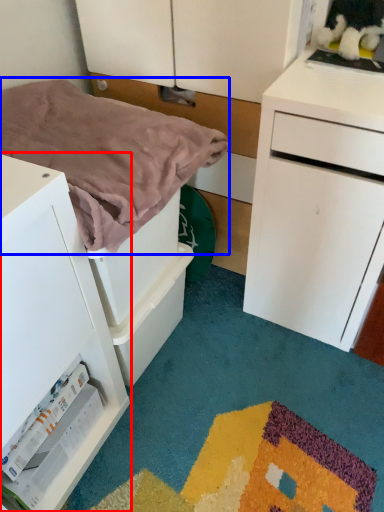
Question: Which point is further to the camera, chest of drawers (highlighted by a red box) or blanket (highlighted by a blue box)?

Choices:
 (A) chest of drawers
 (B) blanket

Answer: (B)